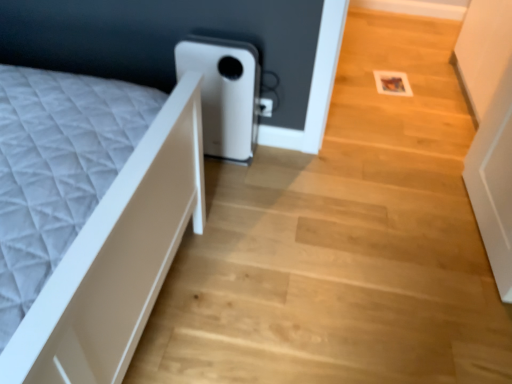
Question: Considering the relative positions of wooden floor at center and white matte water heater at center in the image provided, is wooden floor at center to the left of white matte water heater at center from the viewer's perspective?

Choices:
 (A) yes
 (B) no

Answer: (B)

Question: From the image's perspective, is wooden floor at center on top of white matte water heater at center?

Choices:
 (A) no
 (B) yes

Answer: (A)

Question: Could you tell me if wooden floor at center is turned towards white matte water heater at center?

Choices:
 (A) yes
 (B) no

Answer: (B)

Question: From the image's perspective, does wooden floor at center appear lower than white matte water heater at center?

Choices:
 (A) yes
 (B) no

Answer: (A)

Question: Are wooden floor at center and white matte water heater at center far apart?

Choices:
 (A) no
 (B) yes

Answer: (A)

Question: Can you confirm if wooden floor at center is taller than white matte water heater at center?

Choices:
 (A) no
 (B) yes

Answer: (A)

Question: Considering the relative sizes of white matte water heater at center and wooden floor at center in the image provided, is white matte water heater at center wider than wooden floor at center?

Choices:
 (A) yes
 (B) no

Answer: (B)

Question: Are white matte water heater at center and wooden floor at center far apart?

Choices:
 (A) no
 (B) yes

Answer: (A)

Question: Does white matte water heater at center turn towards wooden floor at center?

Choices:
 (A) no
 (B) yes

Answer: (A)

Question: Would you say wooden floor at center is part of white matte water heater at center's contents?

Choices:
 (A) no
 (B) yes

Answer: (A)

Question: Considering the relative sizes of white matte water heater at center and wooden floor at center in the image provided, is white matte water heater at center bigger than wooden floor at center?

Choices:
 (A) yes
 (B) no

Answer: (B)

Question: From the image's perspective, is white matte water heater at center beneath wooden floor at center?

Choices:
 (A) no
 (B) yes

Answer: (A)

Question: From their relative heights in the image, would you say wooden floor at center is taller or shorter than white matte water heater at center?

Choices:
 (A) tall
 (B) short

Answer: (B)